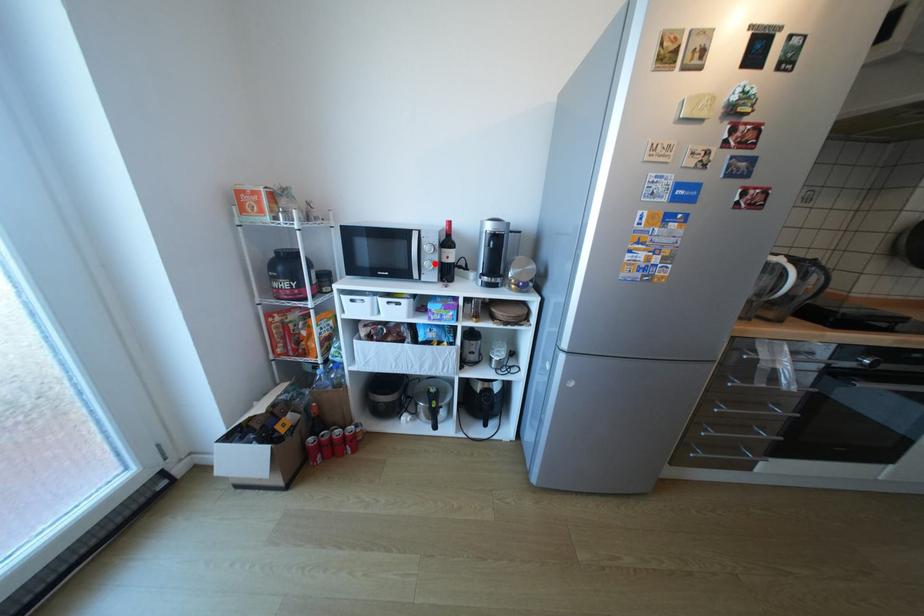
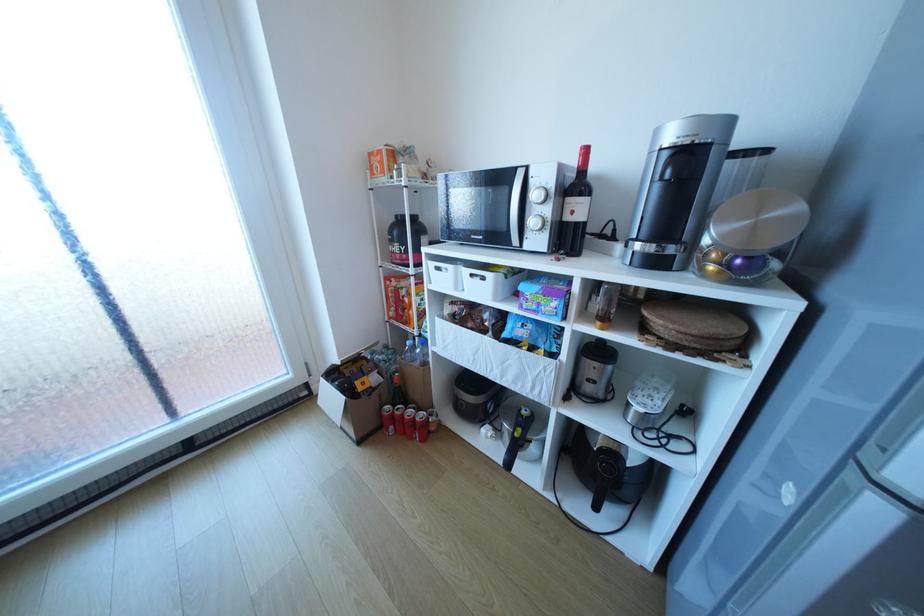
Question: I am providing you with two images of the same scene from different viewpoints. A red point is marked on the first image. At the location where the point appears in image 1, is it still visible in image 2?

Choices:
 (A) Yes
 (B) No

Answer: (A)